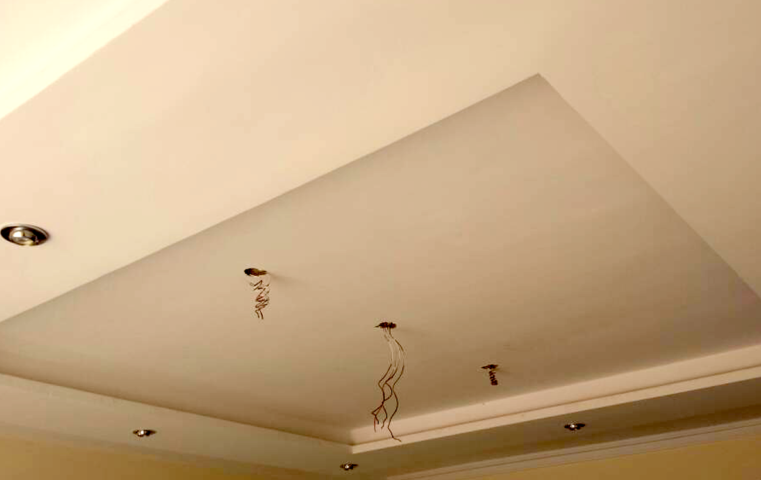
The image size is (761, 480). In order to click on tip of hanging wires in this screenshot , I will do `click(399, 442)`, `click(256, 316)`, `click(495, 386)`.